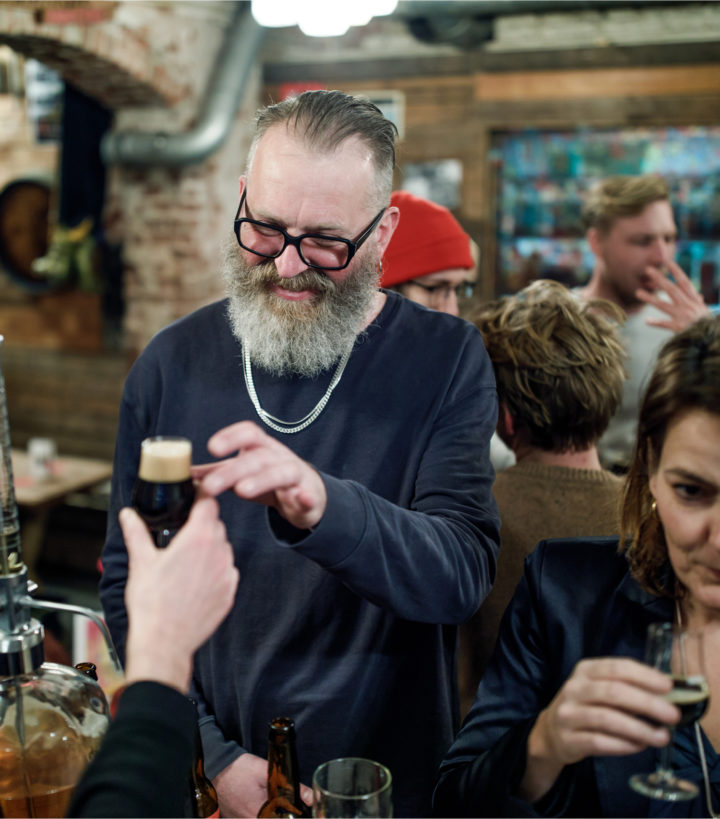
Identify the location of light bulb. The width and height of the screenshot is (720, 819). (317, 20).